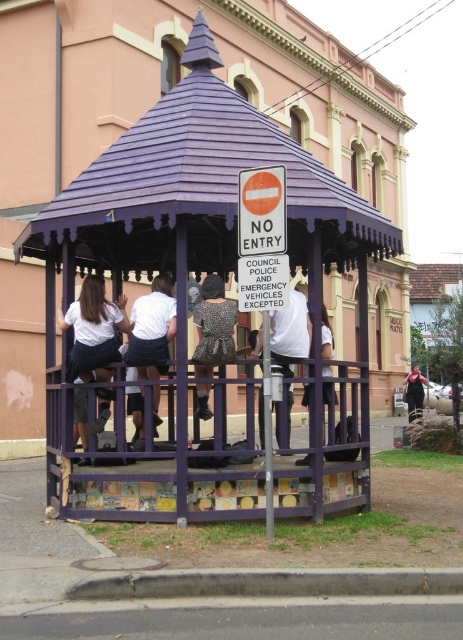
How much distance is there between purple painted wood gazebo at center and white fabric shirt at center?

purple painted wood gazebo at center is 2.02 meters away from white fabric shirt at center.

Does purple painted wood gazebo at center have a smaller size compared to white fabric shirt at center?

No, purple painted wood gazebo at center is not smaller than white fabric shirt at center.

The width and height of the screenshot is (463, 640). Identify the location of purple painted wood gazebo at center. (x=205, y=220).

The height and width of the screenshot is (640, 463). Find the location of `purple painted wood gazebo at center`. purple painted wood gazebo at center is located at coordinates (205, 220).

Looking at this image, between white cotton shirt at center and black fabric person at lower right, which one is positioned higher?

white cotton shirt at center is above.

Is point (137, 365) positioned before point (415, 388)?

Yes, point (137, 365) is in front of point (415, 388).

What do you see at coordinates (151, 330) in the screenshot?
I see `white cotton shirt at center` at bounding box center [151, 330].

Locate an element on the screen. white cotton shirt at center is located at coordinates (151, 330).

Is printed fabric dress at center wider than black fabric person at lower right?

In fact, printed fabric dress at center might be narrower than black fabric person at lower right.

What do you see at coordinates (213, 326) in the screenshot? This screenshot has width=463, height=640. I see `printed fabric dress at center` at bounding box center [213, 326].

What are the coordinates of `printed fabric dress at center` in the screenshot? It's located at (213, 326).